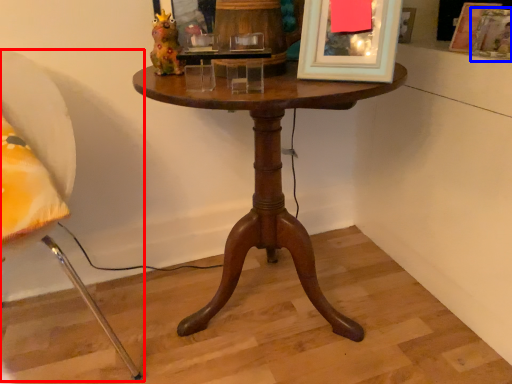
Question: Among these objects, which one is nearest to the camera, chair (highlighted by a red box) or picture frame (highlighted by a blue box)?

Choices:
 (A) chair
 (B) picture frame

Answer: (A)